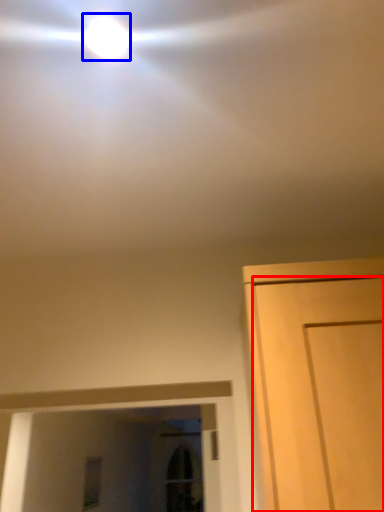
Question: Which of the following is the farthest to the observer, door (highlighted by a red box) or droplight (highlighted by a blue box)?

Choices:
 (A) door
 (B) droplight

Answer: (B)